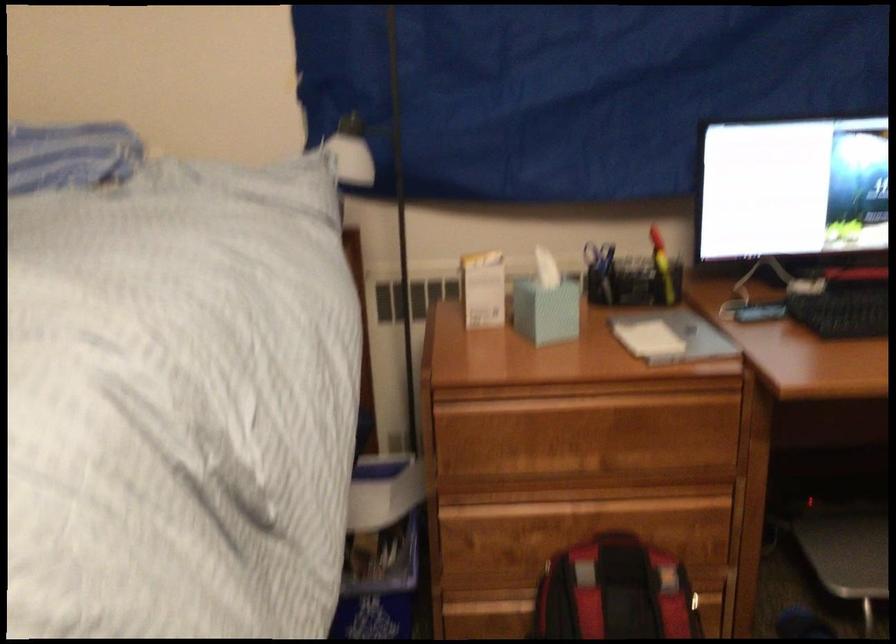
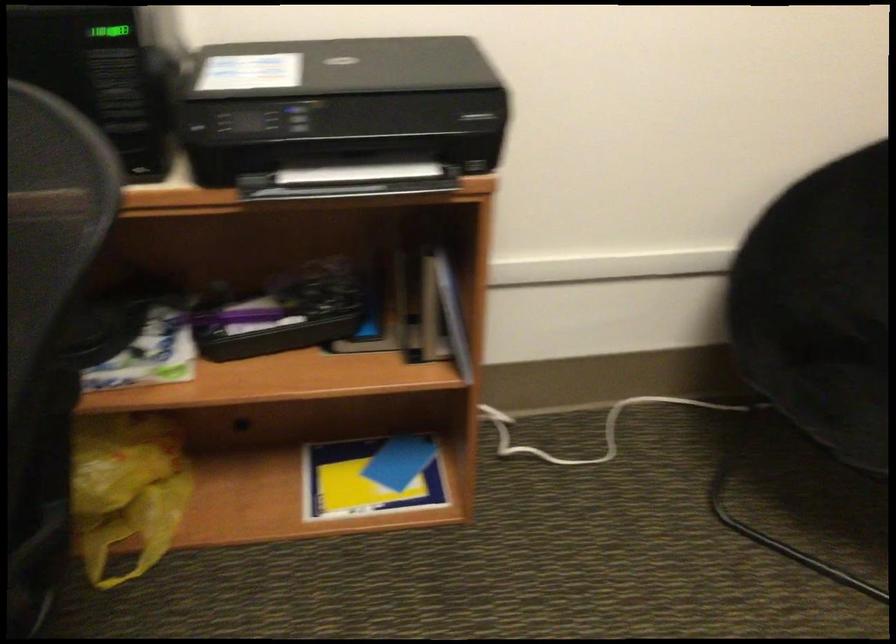
Based on the photo, first-person continuous shooting, in which direction is the camera rotating?

The camera rotated toward right-down.